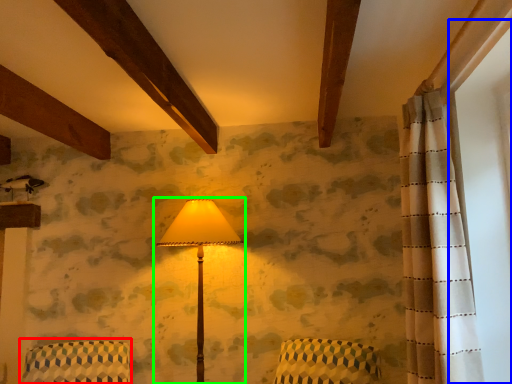
Question: Based on their relative distances, which object is nearer to armchair (highlighted by a red box)? Choose from window screen (highlighted by a blue box) and lamp (highlighted by a green box).

Choices:
 (A) window screen
 (B) lamp

Answer: (B)